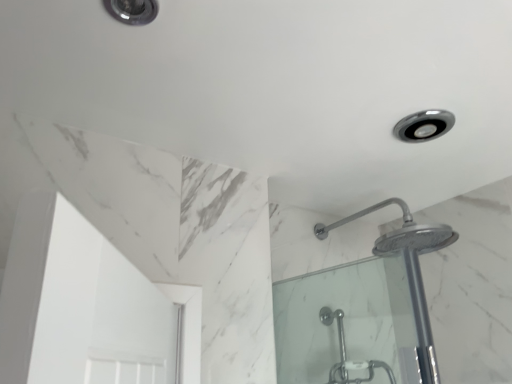
Question: Does matte silver light fixture at upper left, placed as the 1th light fixture when sorted from left to right, appear on the left side of polished chrome shower head at upper right?

Choices:
 (A) yes
 (B) no

Answer: (A)

Question: Can you confirm if matte silver light fixture at upper left, which appears as the first light fixture when viewed from the top, is shorter than polished chrome shower head at upper right?

Choices:
 (A) yes
 (B) no

Answer: (A)

Question: From the image's perspective, is matte silver light fixture at upper left, which appears as the first light fixture when viewed from the top, above polished chrome shower head at upper right?

Choices:
 (A) yes
 (B) no

Answer: (A)

Question: Considering the relative sizes of matte silver light fixture at upper left, which appears as the first light fixture when viewed from the top, and polished chrome shower head at upper right in the image provided, is matte silver light fixture at upper left, which appears as the first light fixture when viewed from the top, bigger than polished chrome shower head at upper right?

Choices:
 (A) no
 (B) yes

Answer: (A)

Question: Considering the relative sizes of matte silver light fixture at upper left, the second light fixture viewed from the back, and polished chrome shower head at upper right in the image provided, is matte silver light fixture at upper left, the second light fixture viewed from the back, wider than polished chrome shower head at upper right?

Choices:
 (A) no
 (B) yes

Answer: (A)

Question: Is point (412, 124) positioned closer to the camera than point (123, 18)?

Choices:
 (A) closer
 (B) farther

Answer: (B)

Question: Looking at their shapes, would you say satin nickel light fixture at upper right, which is counted as the 2th light fixture, starting from the top, is wider or thinner than matte silver light fixture at upper left, which appears as the first light fixture when viewed from the top?

Choices:
 (A) thin
 (B) wide

Answer: (B)

Question: Is satin nickel light fixture at upper right, which appears as the 1th light fixture when viewed from the right, bigger or smaller than matte silver light fixture at upper left, the second light fixture positioned from the bottom?

Choices:
 (A) big
 (B) small

Answer: (A)

Question: Visually, is satin nickel light fixture at upper right, arranged as the first light fixture when viewed from the back, positioned to the left or to the right of matte silver light fixture at upper left, the second light fixture positioned from the bottom?

Choices:
 (A) right
 (B) left

Answer: (A)

Question: Looking at the image, does matte silver light fixture at upper left, the second light fixture from the right, seem bigger or smaller compared to polished chrome shower head at upper right?

Choices:
 (A) big
 (B) small

Answer: (B)

Question: Considering their positions, is matte silver light fixture at upper left, the first light fixture viewed from the front, located in front of or behind polished chrome shower head at upper right?

Choices:
 (A) behind
 (B) front

Answer: (B)

Question: From the image's perspective, relative to polished chrome shower head at upper right, is matte silver light fixture at upper left, the first light fixture viewed from the front, above or below?

Choices:
 (A) below
 (B) above

Answer: (B)

Question: From a real-world perspective, relative to polished chrome shower head at upper right, is matte silver light fixture at upper left, the first light fixture viewed from the front, vertically above or below?

Choices:
 (A) above
 (B) below

Answer: (A)

Question: Is polished chrome shower head at upper right inside or outside of satin nickel light fixture at upper right, the 2th light fixture in the left-to-right sequence?

Choices:
 (A) inside
 (B) outside

Answer: (B)

Question: In terms of width, does polished chrome shower head at upper right look wider or thinner when compared to satin nickel light fixture at upper right, which appears as the 1th light fixture when viewed from the right?

Choices:
 (A) wide
 (B) thin

Answer: (A)